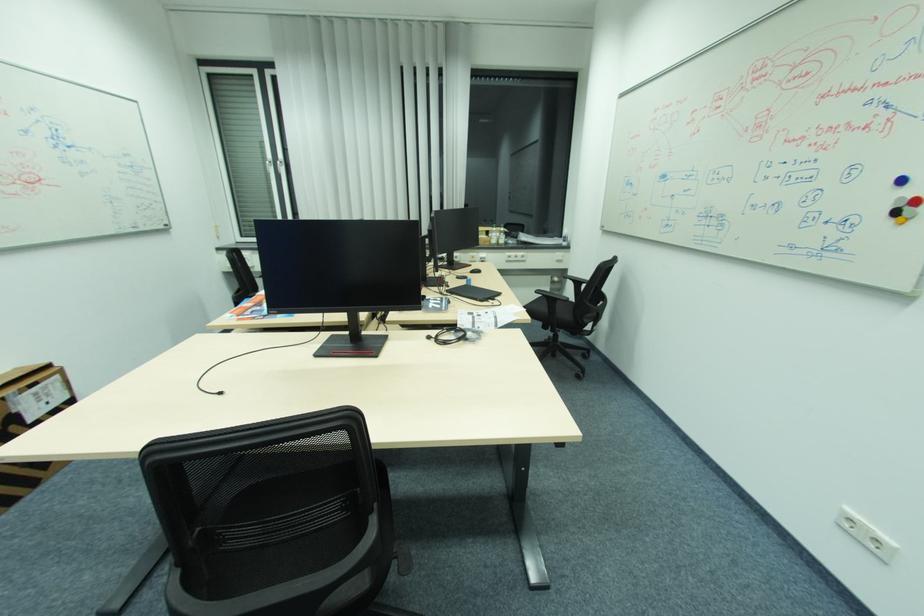
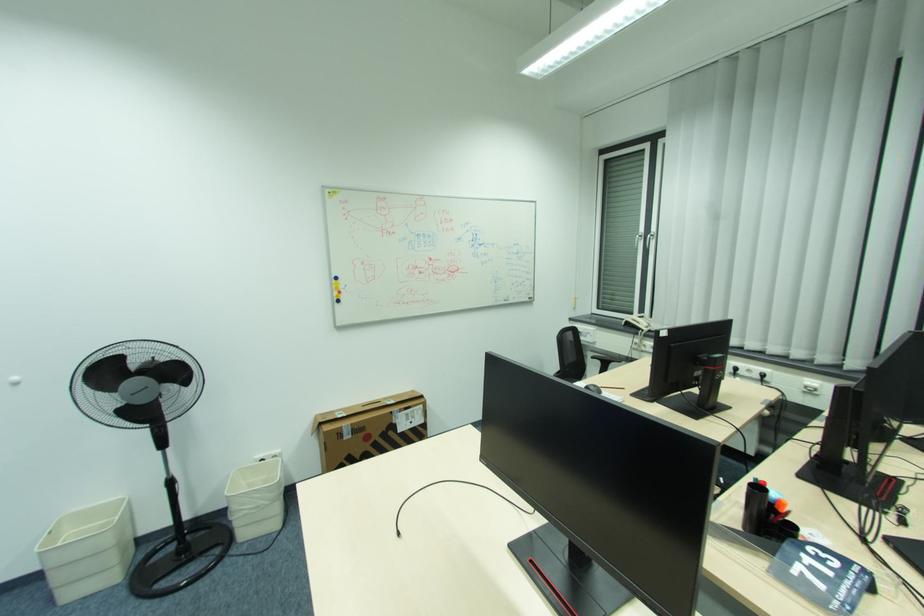
Question: The camera is either moving clockwise (left) or counter-clockwise (right) around the object. The first image is from the beginning of the video and the second image is from the end. Is the camera moving left or right when shooting the video?

Choices:
 (A) Left
 (B) Right

Answer: (B)